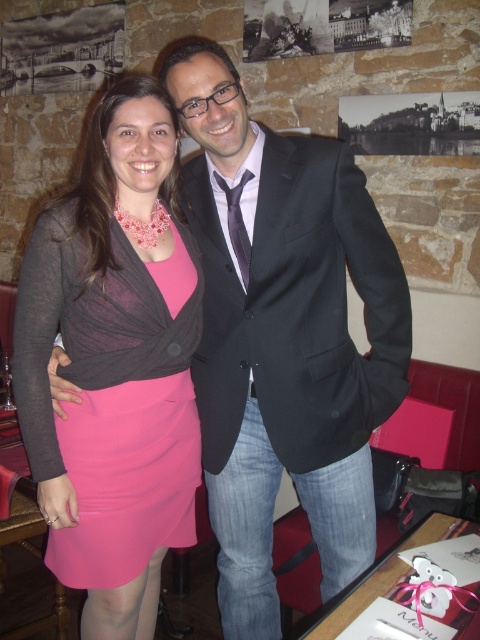
You are taking a photo of the two people in the image. You notice two points marked in the image. The first point is at coordinates point (175, 273) and the second point is at point (214, 278). Which point is closer to the camera?

Point (175, 273) is closer to the camera than point (214, 278).

You are a photographer at this event. You want to take a photo of the two people in the image so that both the pink satin dress at center and the black smooth suit at center are clearly visible. Which person should you position closer to the camera to ensure their clothing items are fully visible?

The black smooth suit at center is behind the pink satin dress at center, so positioning the person wearing the pink satin dress at center closer to the camera will ensure both items are visible without one blocking the other.